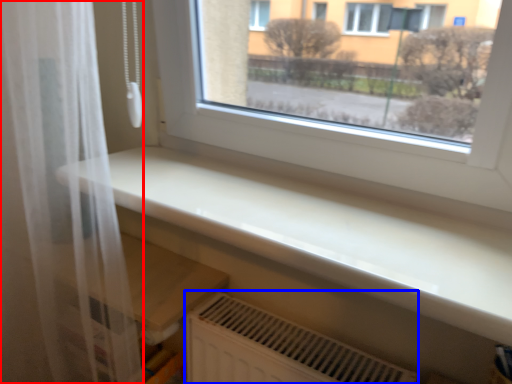
Question: Among these objects, which one is nearest to the camera, shower curtain (highlighted by a red box) or air conditioning (highlighted by a blue box)?

Choices:
 (A) shower curtain
 (B) air conditioning

Answer: (A)